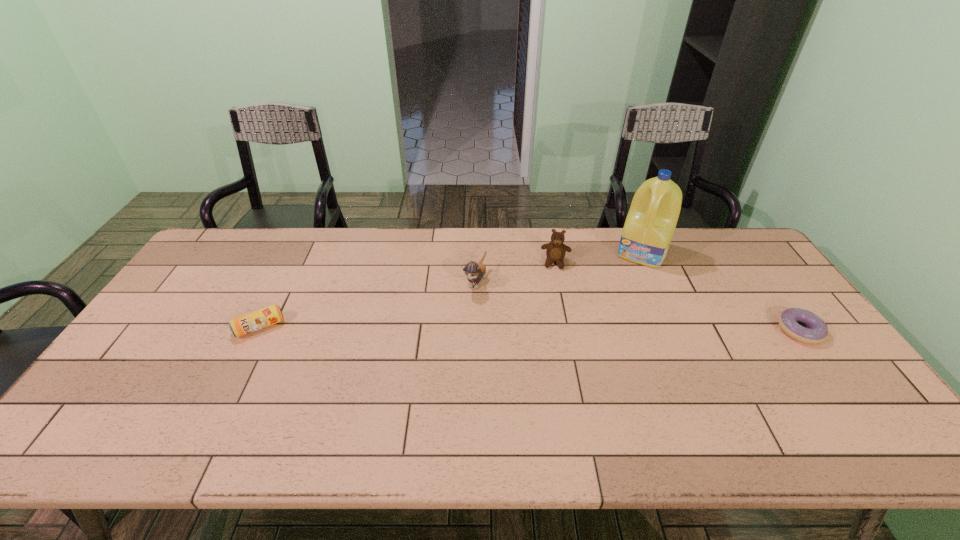
Identify which object is the closest to the teddy bear. Please provide its 2D coordinates. Your answer should be formatted as a tuple, i.e. [(x, y)], where the tuple contains the x and y coordinates of a point satisfying the conditions above.

[(651, 221)]

Where is `vacant area in the image that satisfies the following two spatial constraints: 1. on the back side of the fourth object from right to left; 2. on the left side of the second object from right to left`? vacant area in the image that satisfies the following two spatial constraints: 1. on the back side of the fourth object from right to left; 2. on the left side of the second object from right to left is located at coordinates (475, 252).